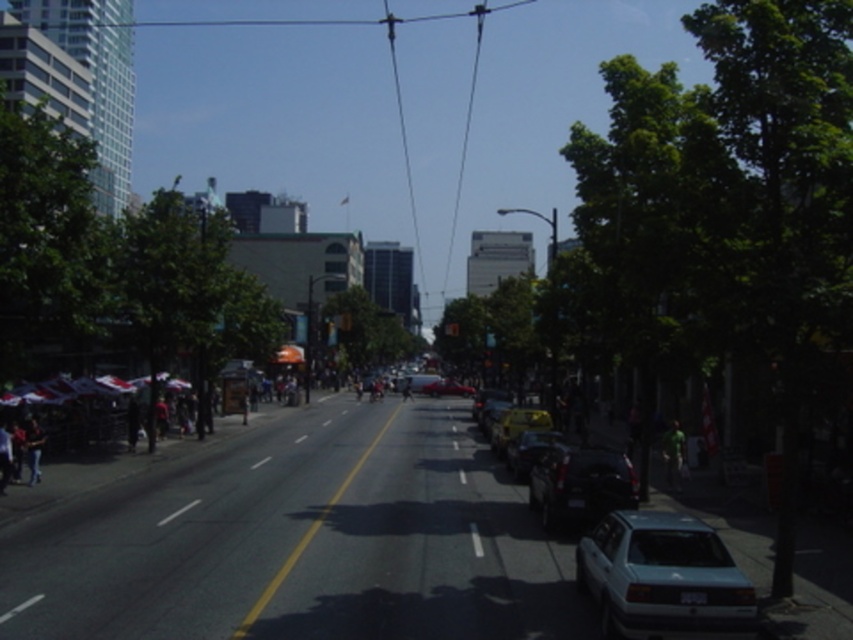
Question: Can you confirm if dark gray pants at lower left is positioned to the left of shiny red sedan at center?

Choices:
 (A) yes
 (B) no

Answer: (A)

Question: Is shiny black car at center wider than jeans at left?

Choices:
 (A) no
 (B) yes

Answer: (B)

Question: Is light blue matte sedan at lower right bigger than shiny black car at center?

Choices:
 (A) no
 (B) yes

Answer: (A)

Question: Based on their relative distances, which object is farther from the light blue matte sedan at lower right?

Choices:
 (A) shiny black sedan at center
 (B) dark gray pants at lower left
 (C) shiny black car at center

Answer: (B)

Question: Which of the following is the farthest from the observer?

Choices:
 (A) shiny black sedan at center
 (B) light blue matte sedan at lower right
 (C) shiny red sedan at center

Answer: (C)

Question: Which of these objects is positioned farthest from the shiny black sedan at center?

Choices:
 (A) green fabric person at center
 (B) light blue matte sedan at lower right
 (C) shiny red sedan at center

Answer: (C)